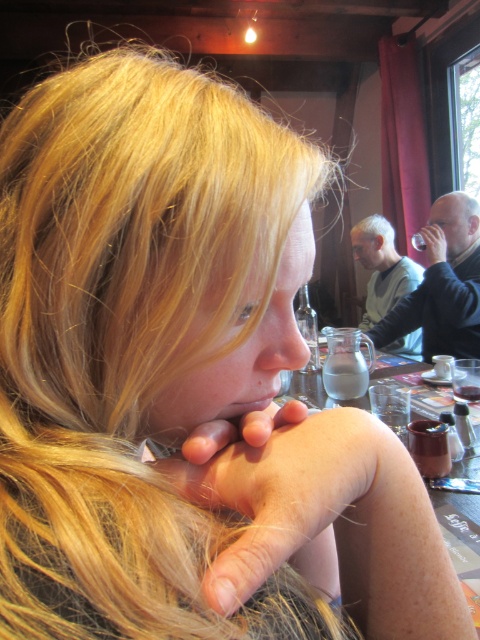
Does matte skin at lower center have a lesser width compared to matte black hand at upper right?

Correct, matte skin at lower center's width is less than matte black hand at upper right's.

In the scene shown: Between matte skin at lower center and matte black hand at upper right, which one appears on the right side from the viewer's perspective?

matte black hand at upper right is more to the right.

What are the coordinates of `matte skin at lower center` in the screenshot? It's located at (249, 408).

Who is more distant from viewer, (188, 493) or (439, 230)?

The point (439, 230) is more distant.

Is point (339, 529) in front of point (434, 230)?

Yes, it is in front of point (434, 230).

This screenshot has width=480, height=640. Find the location of `pale skin/hair at center`. pale skin/hair at center is located at coordinates (288, 499).

Can you confirm if pale skin/hair at center is bigger than transparent glass table at center?

No.

Measure the distance between pale skin/hair at center and transparent glass table at center.

22.37 inches

You are a GUI agent. You are given a task and a screenshot of the screen. Output one action in this format:
    pyautogui.click(x=<x>, y=<y>)
    Task: Click on the pale skin/hair at center
    The height and width of the screenshot is (640, 480).
    Given the screenshot: What is the action you would take?
    pyautogui.click(x=288, y=499)